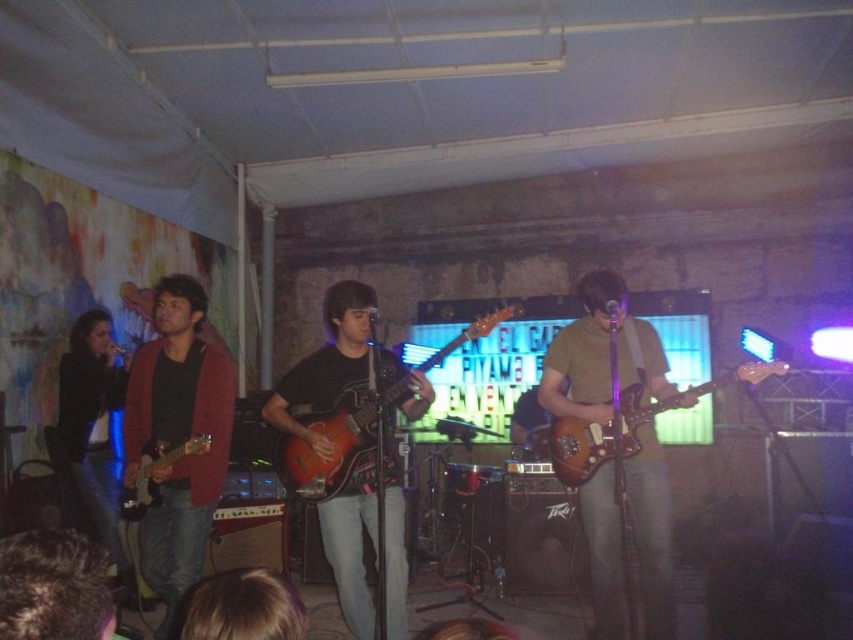
You are a photographer at the back of the venue trying to capture a clear shot of the matte black guitar at center and the blonde hair at lower center. Based on their positions, which one is closer to the camera?

The matte black guitar at center is located below blonde hair at lower center, meaning the blonde hair at lower center is closer to the camera.